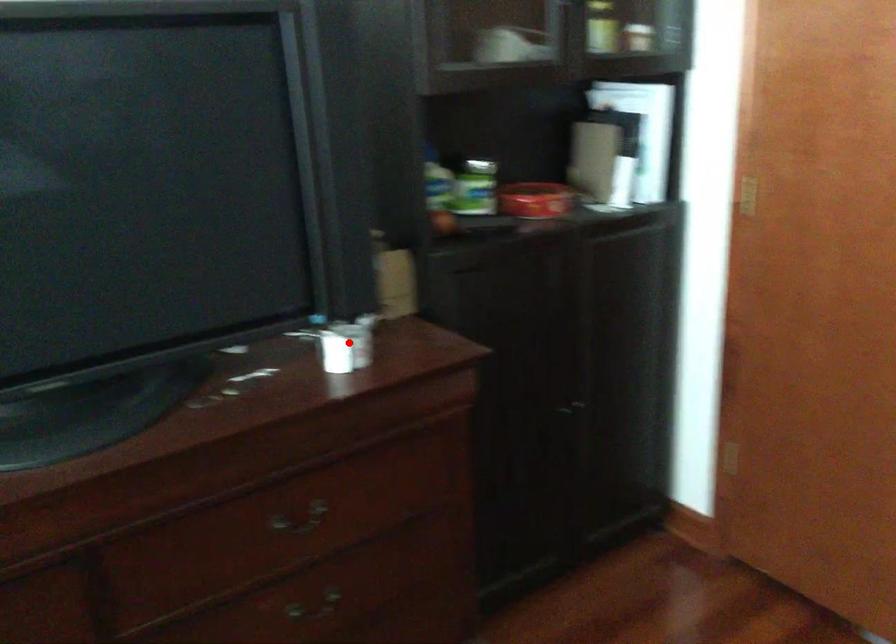
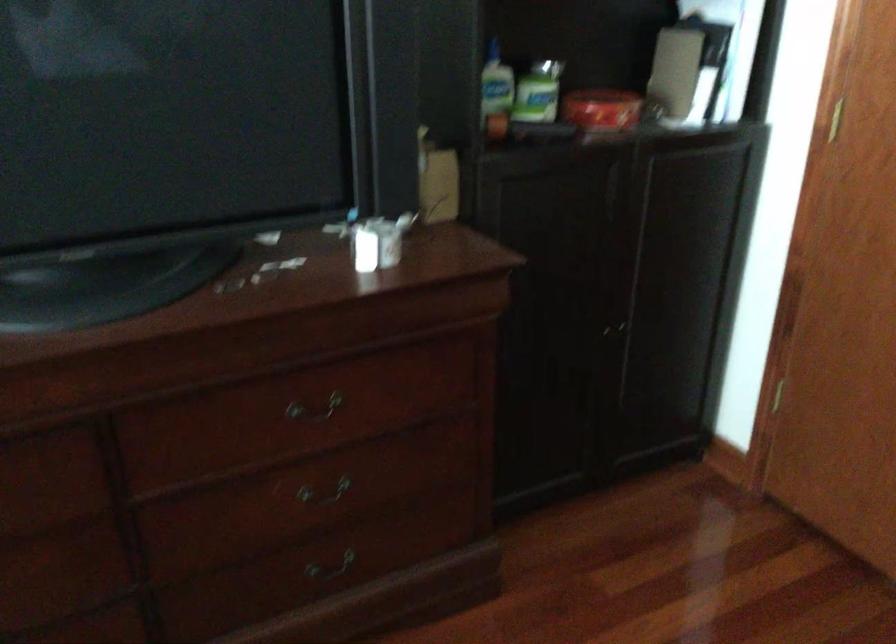
The point at the highlighted location is marked in the first image. Where is the corresponding point in the second image?

(378, 242)